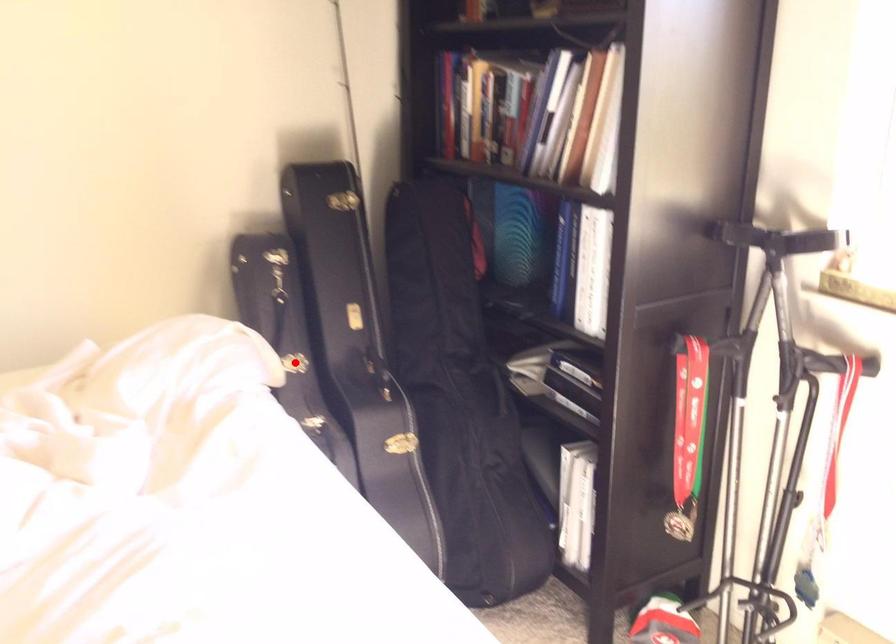
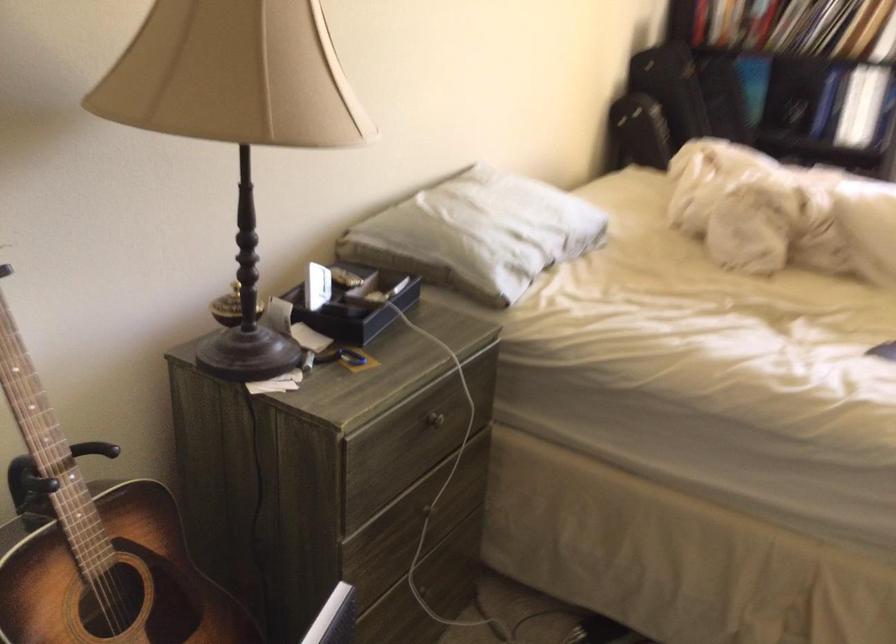
Question: I am providing you with two images of the same scene from different viewpoints. A red point is marked on the first image. Can you still see the location of the red point in image 2?

Choices:
 (A) Yes
 (B) No

Answer: (B)